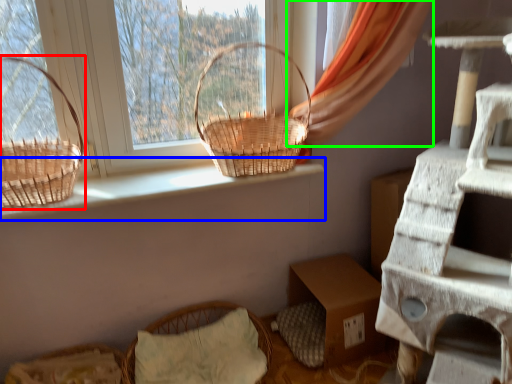
Question: Considering the real-world distances, which object is farthest from picnic basket (highlighted by a red box)? window sill (highlighted by a blue box) or curtain (highlighted by a green box)?

Choices:
 (A) window sill
 (B) curtain

Answer: (B)